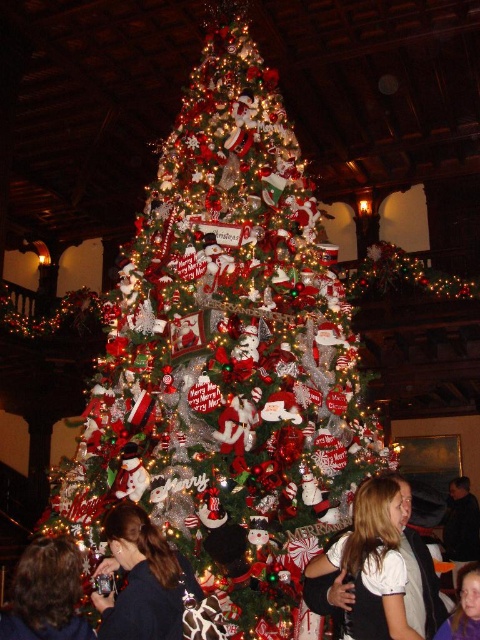
Question: Does dark brown hair at lower left come behind dark blue shirt at lower right?

Choices:
 (A) no
 (B) yes

Answer: (A)

Question: Which point is closer to the camera?

Choices:
 (A) (44, 541)
 (B) (448, 634)
 (C) (479, 518)
 (D) (361, 576)

Answer: (D)

Question: Does white cotton shirt at center have a lesser width compared to dark brown hair at lower left?

Choices:
 (A) yes
 (B) no

Answer: (B)

Question: Which object is the farthest from the dark blue sweater at lower left?

Choices:
 (A) dark blue shirt at lower right
 (B) smooth skin face at lower right

Answer: (A)

Question: Which is farther from the white cotton shirt at center?

Choices:
 (A) dark blue sweater at lower left
 (B) dark brown hair at lower left
 (C) dark blue shirt at lower right

Answer: (C)

Question: Is white cotton shirt at center in front of dark blue sweater at lower left?

Choices:
 (A) yes
 (B) no

Answer: (B)